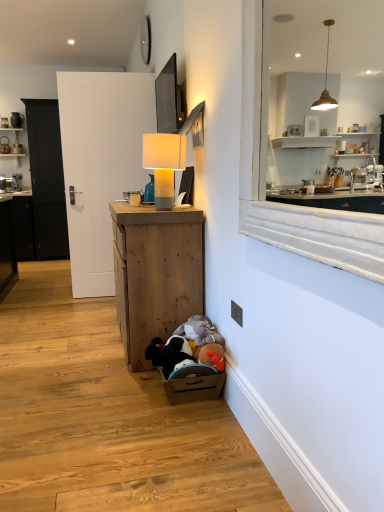
Question: Is black plastic electric outlet at lower right shorter than white wooden door at center?

Choices:
 (A) yes
 (B) no

Answer: (A)

Question: Would you say black plastic electric outlet at lower right contains white wooden door at center?

Choices:
 (A) no
 (B) yes

Answer: (A)

Question: From a real-world perspective, is black plastic electric outlet at lower right located higher than white wooden door at center?

Choices:
 (A) no
 (B) yes

Answer: (A)

Question: Is black plastic electric outlet at lower right in front of white wooden door at center?

Choices:
 (A) no
 (B) yes

Answer: (B)

Question: Is black plastic electric outlet at lower right located outside white wooden door at center?

Choices:
 (A) no
 (B) yes

Answer: (B)

Question: Is black plastic electric outlet at lower right facing towards white wooden door at center?

Choices:
 (A) no
 (B) yes

Answer: (A)

Question: Considering the relative positions of matte gray table lamp at center and white marble window at upper right in the image provided, is matte gray table lamp at center behind white marble window at upper right?

Choices:
 (A) no
 (B) yes

Answer: (B)

Question: Considering the relative positions of matte gray table lamp at center and white marble window at upper right in the image provided, is matte gray table lamp at center to the right of white marble window at upper right from the viewer's perspective?

Choices:
 (A) no
 (B) yes

Answer: (A)

Question: Could you tell me if matte gray table lamp at center is facing white marble window at upper right?

Choices:
 (A) yes
 (B) no

Answer: (B)

Question: Considering the relative sizes of matte gray table lamp at center and white marble window at upper right in the image provided, is matte gray table lamp at center thinner than white marble window at upper right?

Choices:
 (A) no
 (B) yes

Answer: (A)

Question: From the image's perspective, is matte gray table lamp at center on top of white marble window at upper right?

Choices:
 (A) yes
 (B) no

Answer: (A)

Question: Would you say matte gray table lamp at center is outside white marble window at upper right?

Choices:
 (A) no
 (B) yes

Answer: (B)

Question: Considering the relative sizes of wooden cabinet at lower center and matte gray table lamp at center in the image provided, is wooden cabinet at lower center bigger than matte gray table lamp at center?

Choices:
 (A) no
 (B) yes

Answer: (B)